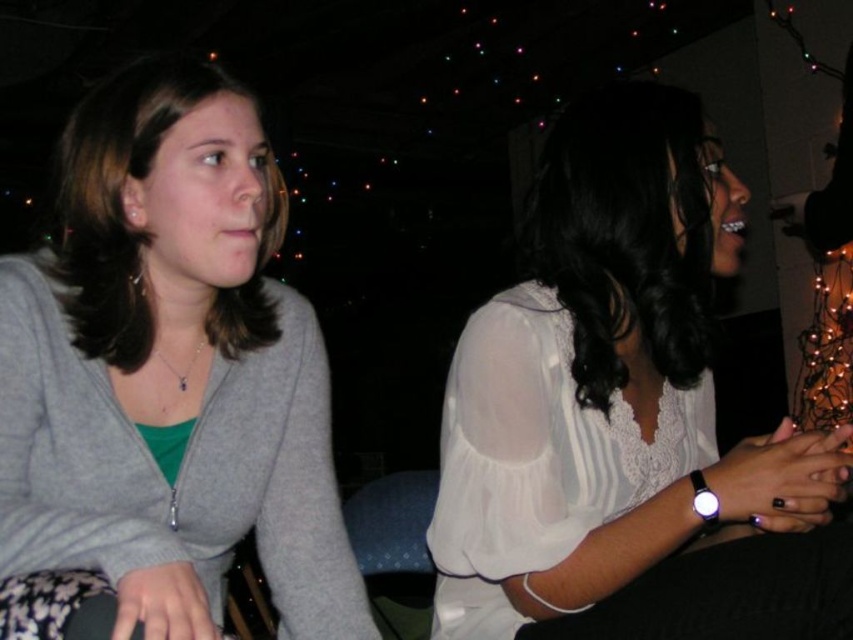
Based on the photo, you are organizing a clothing display and need to arrange the matte gray sweater at left and the white sheer blouse at center according to their positions in the image. Which item should be placed to the right side of the display?

The white sheer blouse at center should be placed to the right side of the display because the matte gray sweater at left is positioned to the left of it in the image.

You are a fashion designer observing a photo of two people at a social event. You need to determine which clothing item is shorter between the matte gray sweater at left and the white sheer blouse at center. Which one is shorter?

The matte gray sweater at left is shorter than the white sheer blouse at center.

You are at a party and want to take a photo of the matte gray sweater at left and the white sheer blouse at center. Since the lighting is dim, you need to adjust your camera settings. Which object should you focus on first to ensure both are in focus?

The matte gray sweater at left is located above the white sheer blouse at center. To ensure both are in focus, focus on the matte gray sweater at left since it is closer to the camera.